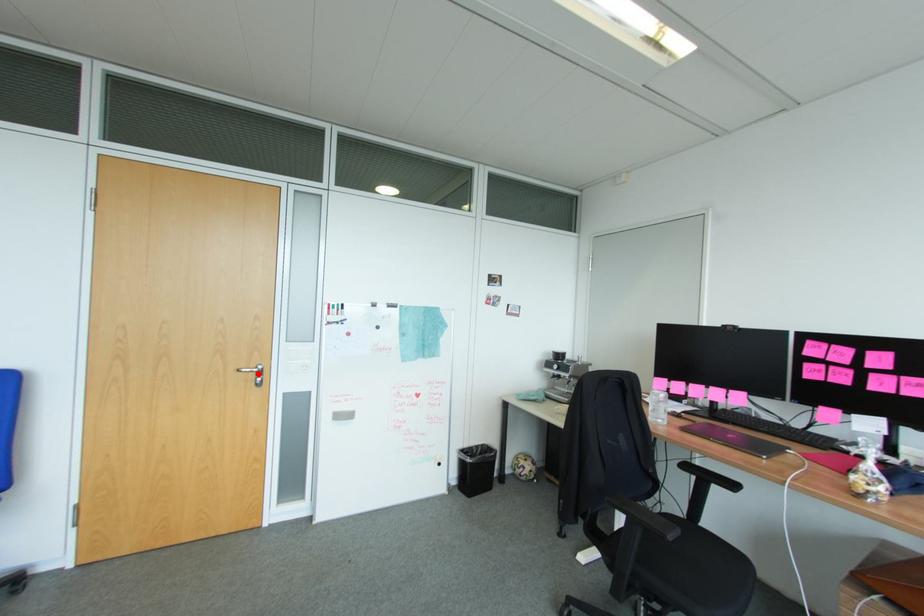
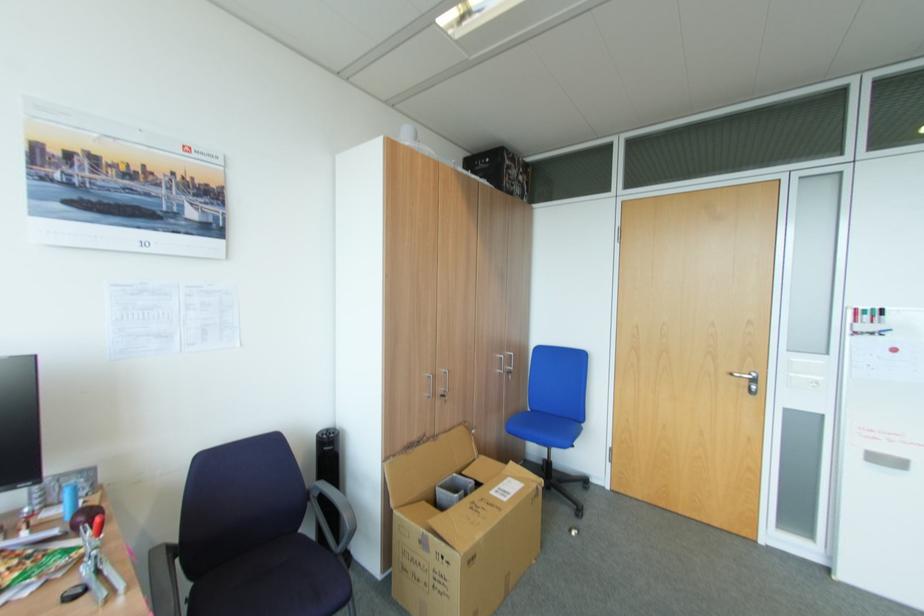
Find the pixel in the second image that matches the highlighted location in the first image.

(751, 381)